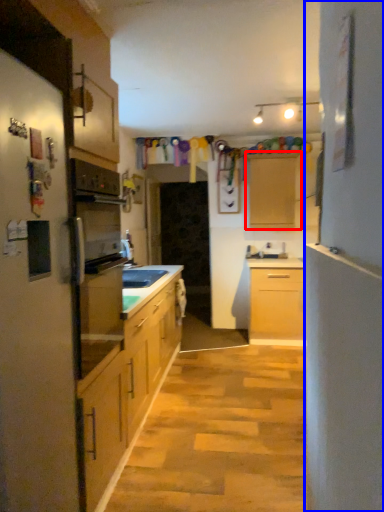
Question: Which object appears closest to the camera in this image, cabinetry (highlighted by a red box) or side (highlighted by a blue box)?

Choices:
 (A) cabinetry
 (B) side

Answer: (B)